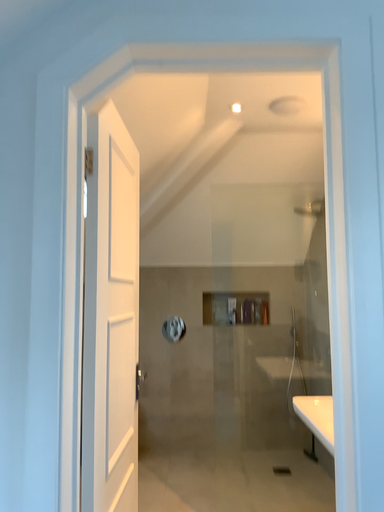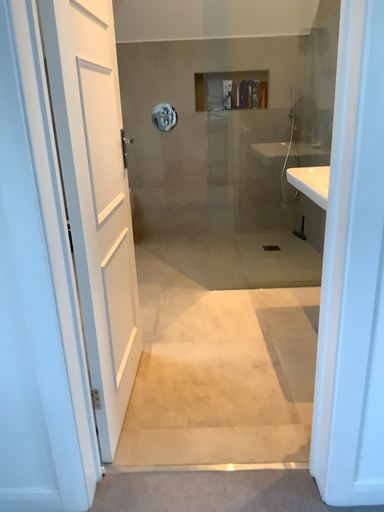
Question: Which way did the camera rotate in the video?

Choices:
 (A) rotated upward
 (B) rotated downward

Answer: (B)